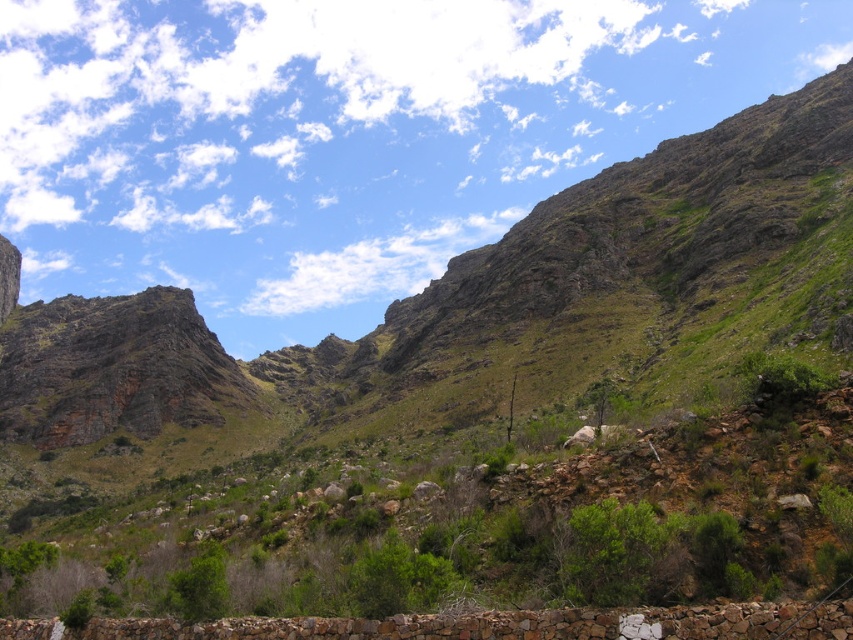
Is point (117, 529) more distant than point (553, 627)?

Yes, it is behind point (553, 627).

Does green leafy shrubs at center come in front of brown stone wall at lower center?

No, green leafy shrubs at center is further to the viewer.

Does point (492, 545) lie behind point (498, 618)?

Yes, it is behind point (498, 618).

Identify the location of green leafy shrubs at center. pos(474,538).